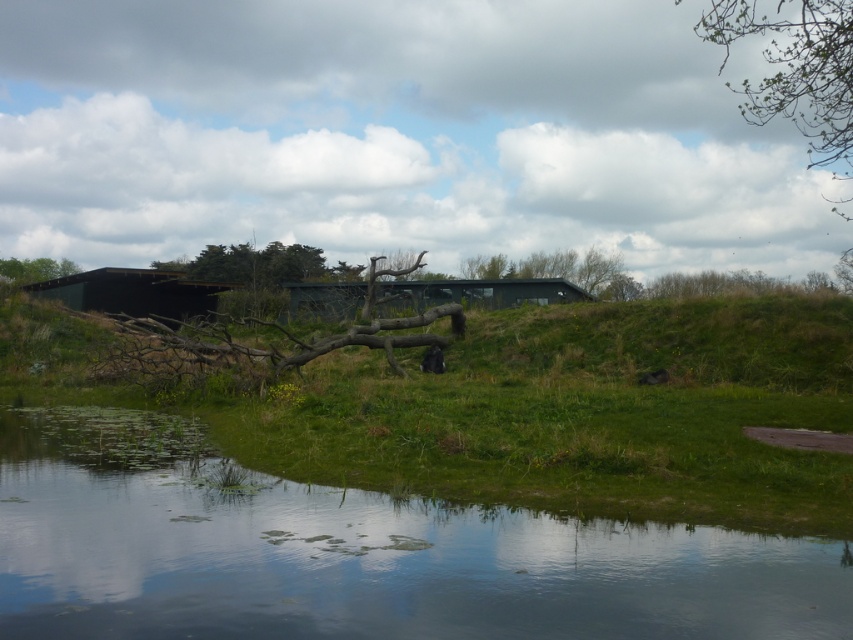
Does green grassy river at lower left appear on the right side of green matte hut at center?

Yes, green grassy river at lower left is to the right of green matte hut at center.

Which is more to the right, green grassy river at lower left or green matte hut at center?

green grassy river at lower left is more to the right.

Describe the element at coordinates (355, 554) in the screenshot. I see `green grassy river at lower left` at that location.

Where is `green grassy river at lower left`? This screenshot has height=640, width=853. green grassy river at lower left is located at coordinates (355, 554).

Is green leafy tree at upper center thinner than green matte tree at center?

No, green leafy tree at upper center is not thinner than green matte tree at center.

Which is in front, point (271, 257) or point (492, 266)?

Point (271, 257) is more forward.

Is point (318, 253) positioned behind point (532, 252)?

No, it is not.

The height and width of the screenshot is (640, 853). Find the location of `green leafy tree at upper center`. green leafy tree at upper center is located at coordinates (252, 264).

The height and width of the screenshot is (640, 853). Describe the element at coordinates (796, 68) in the screenshot. I see `green leafy branch at upper right` at that location.

Between point (825, 86) and point (291, 253), which one is positioned behind?

The point (291, 253) is more distant.

What do you see at coordinates (796, 68) in the screenshot? I see `green leafy branch at upper right` at bounding box center [796, 68].

The width and height of the screenshot is (853, 640). Find the location of `green leafy branch at upper right`. green leafy branch at upper right is located at coordinates (796, 68).